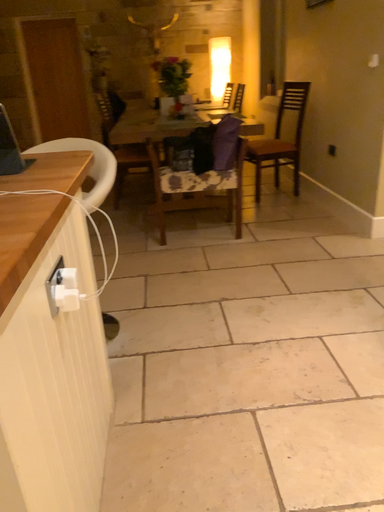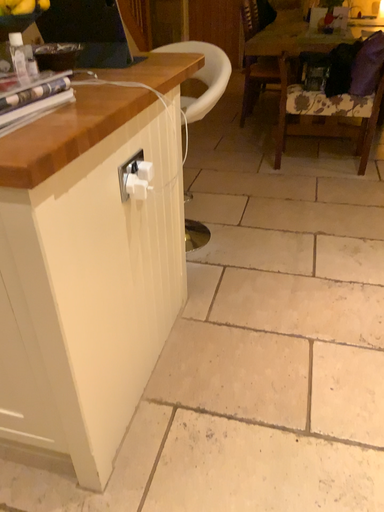
Question: Which way did the camera rotate in the video?

Choices:
 (A) rotated right
 (B) rotated left

Answer: (B)